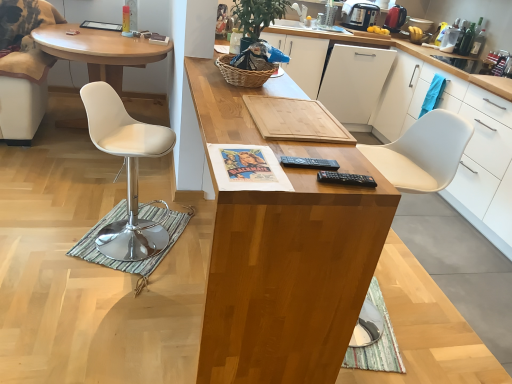
Image resolution: width=512 pixels, height=384 pixels. Find the location of `vacant space in front of green striped mat at lower left`. vacant space in front of green striped mat at lower left is located at coordinates (99, 302).